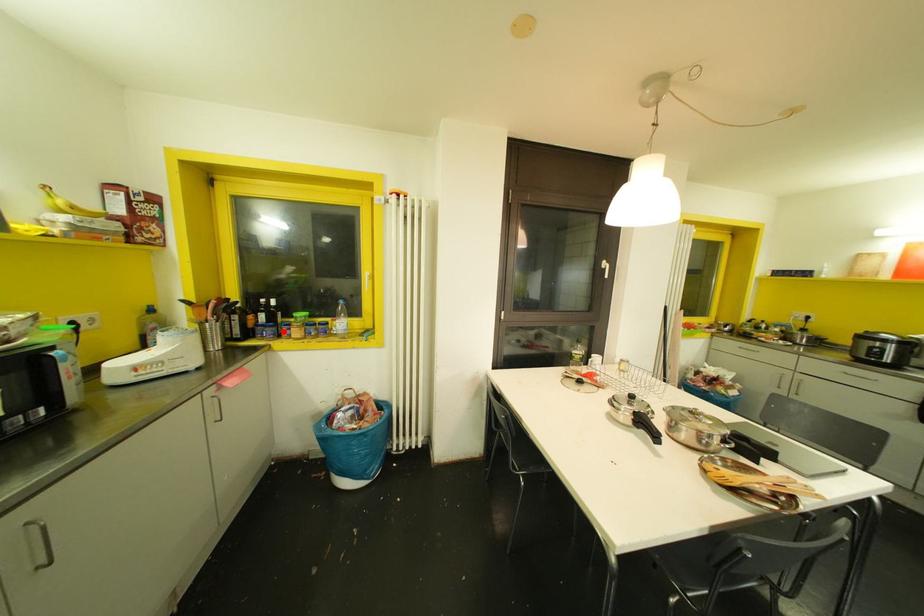
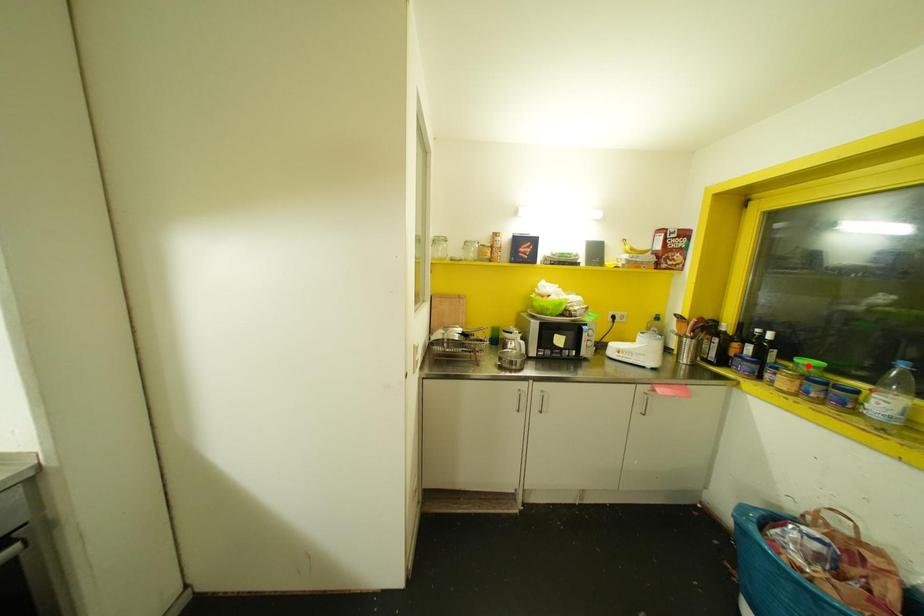
I am providing you with two images of the same scene from different viewpoints. A red point is marked on the first image and another point is marked on the second image. Does the point marked in image1 correspond to the same location as the one in image2?

No